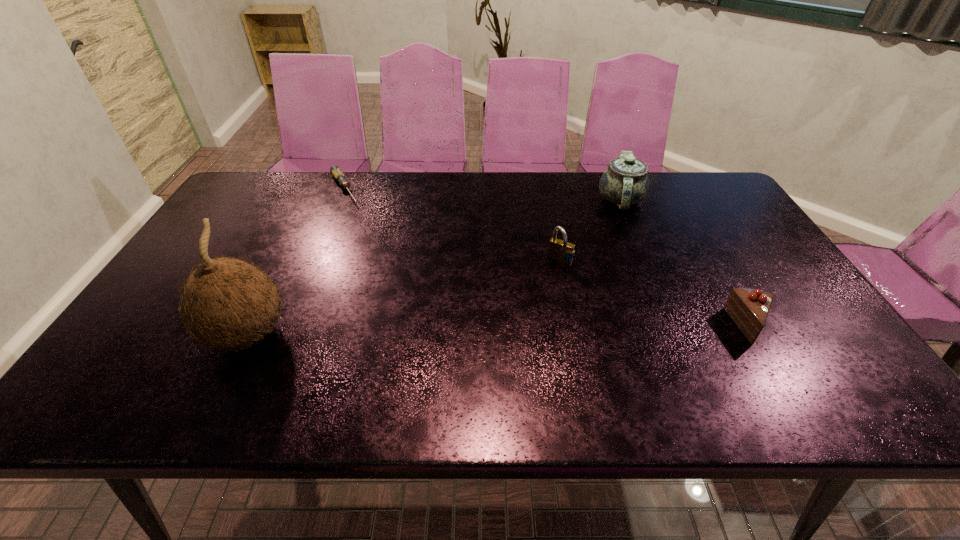
Image resolution: width=960 pixels, height=540 pixels. What are the coordinates of `chinaware at the far edge` in the screenshot? It's located at (625, 182).

You are a GUI agent. You are given a task and a screenshot of the screen. Output one action in this format:
    pyautogui.click(x=<x>, y=<y>)
    Task: Click on the coconut at the near edge
    Image resolution: width=960 pixels, height=540 pixels.
    Given the screenshot: What is the action you would take?
    pyautogui.click(x=226, y=302)

Find the location of `chocolate cake that is at the near edge`. chocolate cake that is at the near edge is located at coordinates (748, 308).

This screenshot has height=540, width=960. Identify the location of object that is at the right edge. (748, 308).

In order to click on object that is at the near right corner in this screenshot , I will do `click(748, 308)`.

Find the location of `free point at the far edge`. free point at the far edge is located at coordinates (494, 190).

The width and height of the screenshot is (960, 540). I want to click on blank space at the near edge, so click(x=371, y=342).

This screenshot has height=540, width=960. In the image, there is a desktop. In order to click on vacant region at the left edge in this screenshot , I will do `click(260, 216)`.

Identify the location of free space at the right edge. The height and width of the screenshot is (540, 960). (750, 250).

This screenshot has height=540, width=960. I want to click on vacant space at the far left corner, so click(251, 190).